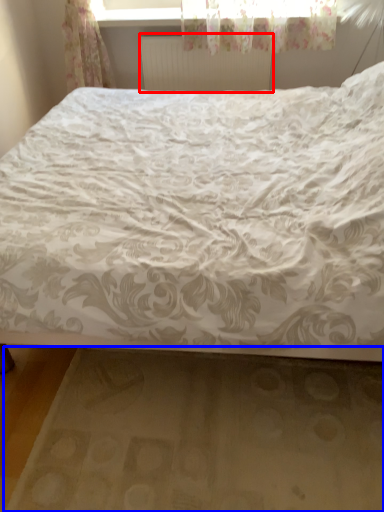
Question: Which object is closer to the camera taking this photo, radiator (highlighted by a red box) or bed frame (highlighted by a blue box)?

Choices:
 (A) radiator
 (B) bed frame

Answer: (B)